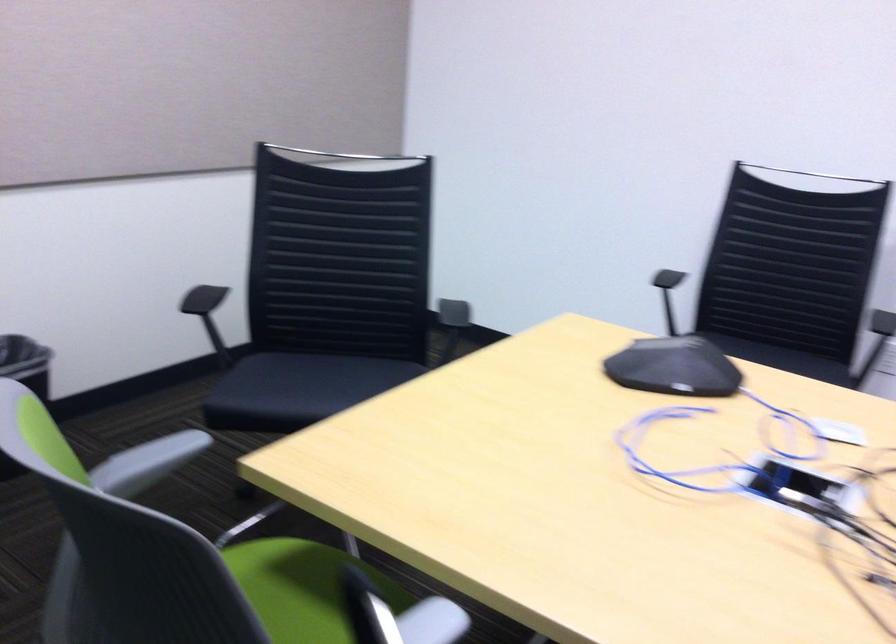
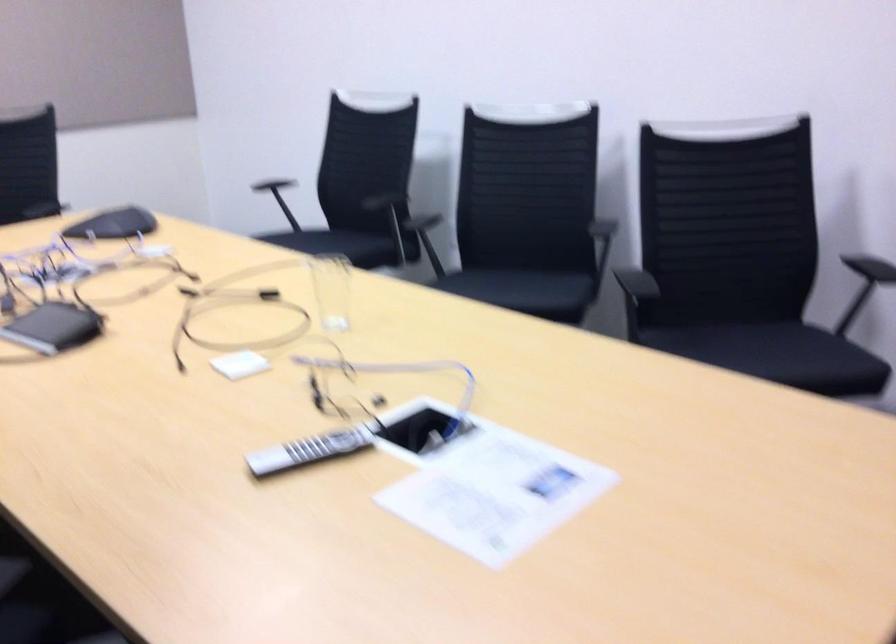
The point at (813, 368) is marked in the first image. Where is the corresponding point in the second image?

(350, 245)